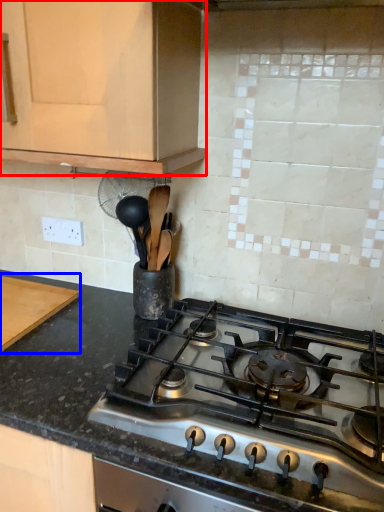
Question: Which point is closer to the camera, cabinetry (highlighted by a red box) or cutting board (highlighted by a blue box)?

Choices:
 (A) cabinetry
 (B) cutting board

Answer: (A)